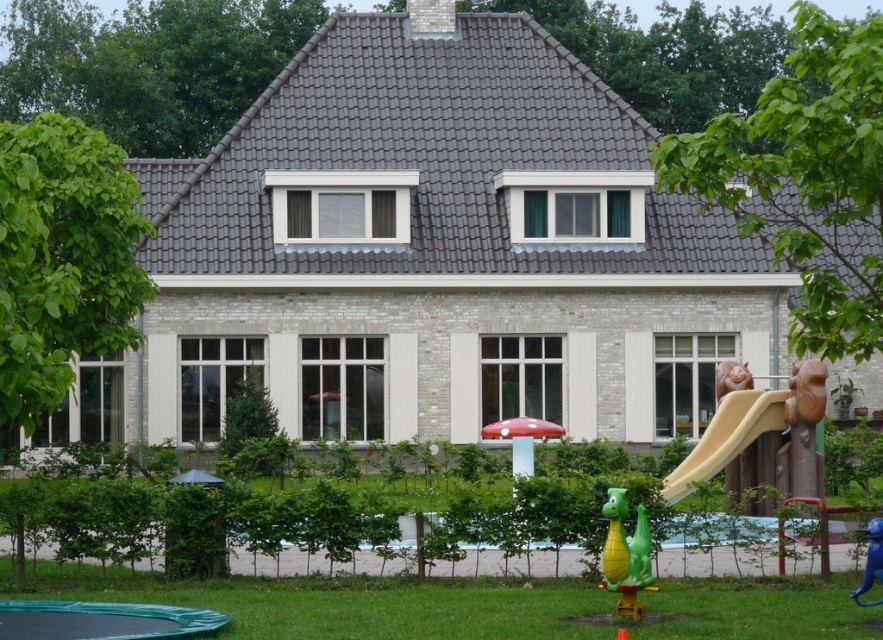
Is the position of green rubber dragon at lower right less distant than that of blue plastic monkey at lower right?

Yes, it is in front of blue plastic monkey at lower right.

Looking at this image, can you confirm if green rubber dragon at lower right is thinner than blue plastic monkey at lower right?

In fact, green rubber dragon at lower right might be wider than blue plastic monkey at lower right.

At what (x,y) coordinates should I click in order to perform the action: click on green rubber dragon at lower right. Please return your answer as a coordinate pair (x, y). The width and height of the screenshot is (883, 640). Looking at the image, I should click on [625, 556].

Find the location of a particular element. smooth beige slide at right is located at coordinates (726, 436).

Is smooth beige slide at right positioned behind green rubber dragon at lower right?

Yes, it is behind green rubber dragon at lower right.

Which is behind, point (721, 449) or point (608, 522)?

The point (721, 449) is behind.

Where is `smooth beige slide at right`? smooth beige slide at right is located at coordinates (726, 436).

Between smooth beige slide at right and blue plastic monkey at lower right, which one appears on the right side from the viewer's perspective?

From the viewer's perspective, smooth beige slide at right appears more on the right side.

Does smooth beige slide at right have a lesser height compared to blue plastic monkey at lower right?

Yes, smooth beige slide at right is shorter than blue plastic monkey at lower right.

You are a GUI agent. You are given a task and a screenshot of the screen. Output one action in this format:
    pyautogui.click(x=<x>, y=<y>)
    Task: Click on the smooth beige slide at right
    
    Given the screenshot: What is the action you would take?
    pyautogui.click(x=726, y=436)